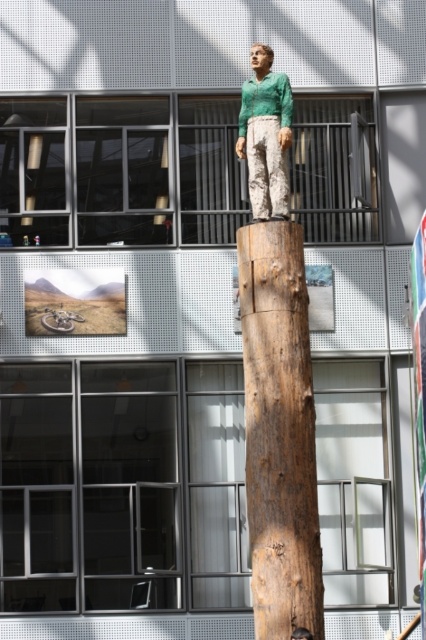
Question: Among these objects, which one is nearest to the camera?

Choices:
 (A) green matte shirt at upper center
 (B) brown rough wood at center

Answer: (B)

Question: Which object is farther from the camera taking this photo?

Choices:
 (A) brown rough wood at center
 (B) green matte shirt at upper center

Answer: (B)

Question: Which object is farther from the camera taking this photo?

Choices:
 (A) green matte shirt at upper center
 (B) brown rough wood at center

Answer: (A)

Question: Is brown rough wood at center to the left of green matte shirt at upper center from the viewer's perspective?

Choices:
 (A) no
 (B) yes

Answer: (A)

Question: Is brown rough wood at center wider than green matte shirt at upper center?

Choices:
 (A) yes
 (B) no

Answer: (A)

Question: Is brown rough wood at center in front of green matte shirt at upper center?

Choices:
 (A) yes
 (B) no

Answer: (A)